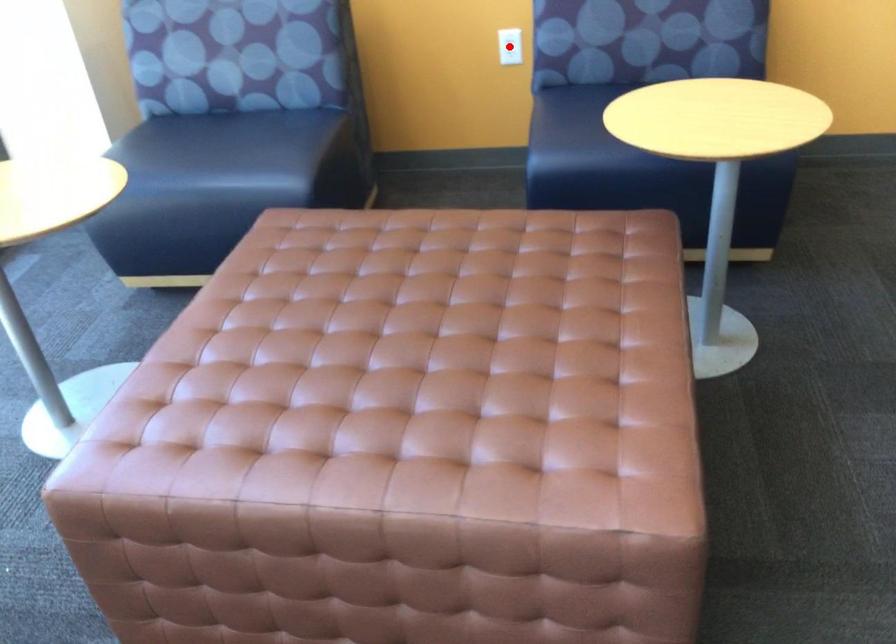
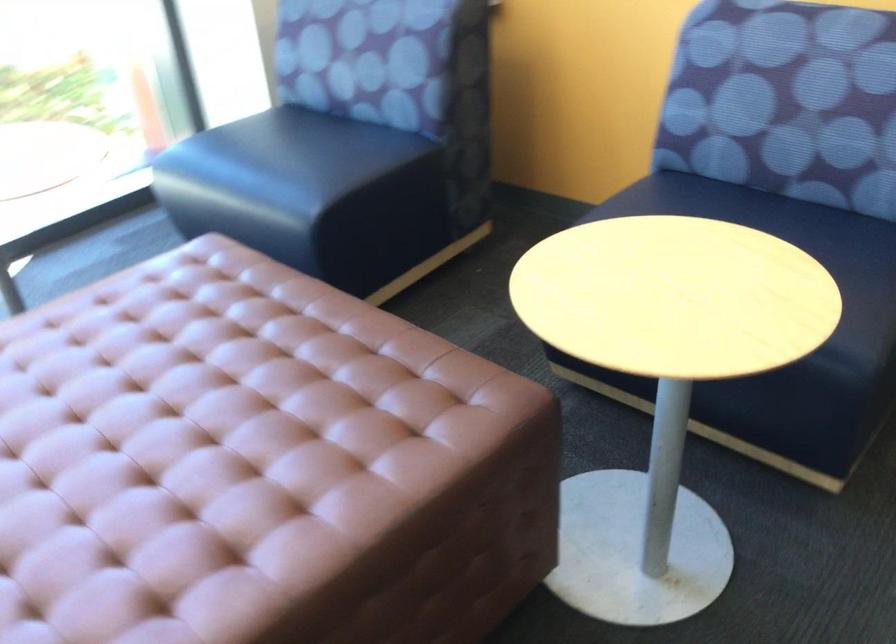
Question: I am providing you with two images of the same scene from different viewpoints. A red point is marked on the first image. Is the red point's position out of view in image 2?

Choices:
 (A) Yes
 (B) No

Answer: (A)